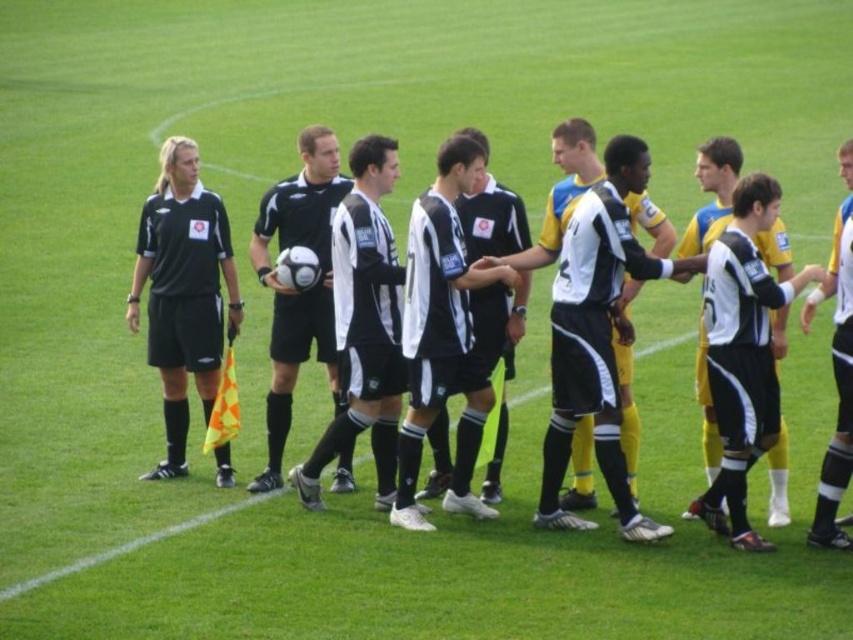
Question: Which point appears farthest from the camera in this image?

Choices:
 (A) (173, 320)
 (B) (276, 464)
 (C) (834, 260)

Answer: (A)

Question: Does black matte soccer ball at center appear over black jersey at center?

Choices:
 (A) no
 (B) yes

Answer: (B)

Question: Is black jersey at center in front of white jersey at center?

Choices:
 (A) yes
 (B) no

Answer: (B)

Question: Does black and white jersey at center have a lesser width compared to yellow/black jersey at center?

Choices:
 (A) no
 (B) yes

Answer: (A)

Question: Which point is farther to the camera?

Choices:
 (A) (834, 227)
 (B) (485, 282)
 (C) (299, 184)
 (D) (173, 188)

Answer: (C)

Question: Among these objects, which one is nearest to the camera?

Choices:
 (A) black jersey at center
 (B) yellow/black jersey at center
 (C) black matte soccer ball at center

Answer: (B)